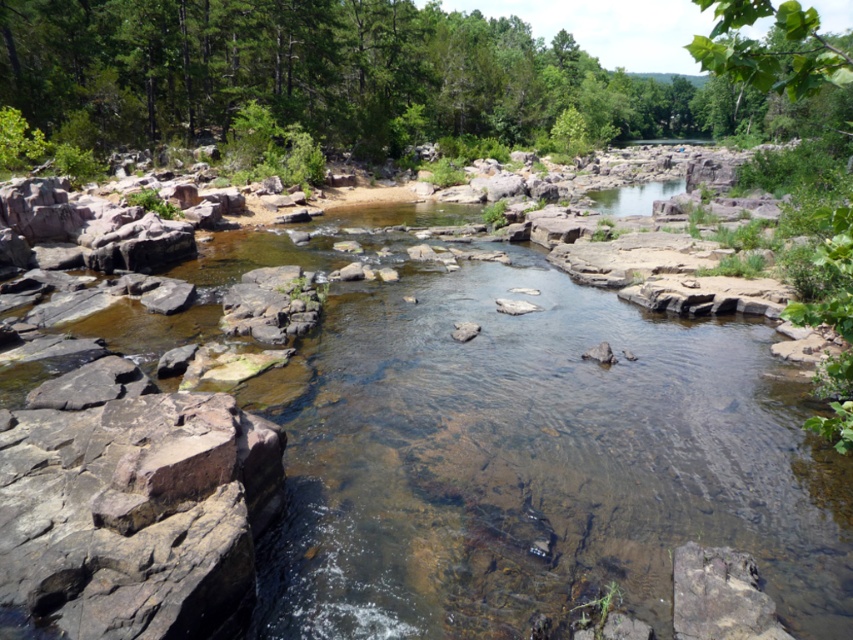
Question: Does green leafy tree at upper right have a larger size compared to clear water at center?

Choices:
 (A) no
 (B) yes

Answer: (B)

Question: Which point appears closest to the camera in this image?

Choices:
 (A) (717, 28)
 (B) (636, 189)

Answer: (A)

Question: Is green leafy tree at upper right to the left of clear water at center from the viewer's perspective?

Choices:
 (A) no
 (B) yes

Answer: (A)

Question: Which point appears farthest from the camera in this image?

Choices:
 (A) (709, 44)
 (B) (592, 196)

Answer: (B)

Question: From the image, what is the correct spatial relationship of green leafy tree at upper right in relation to clear water at center?

Choices:
 (A) above
 (B) below

Answer: (A)

Question: Which of the following is the farthest from the observer?

Choices:
 (A) green leafy tree at upper right
 (B) clear water at center

Answer: (B)